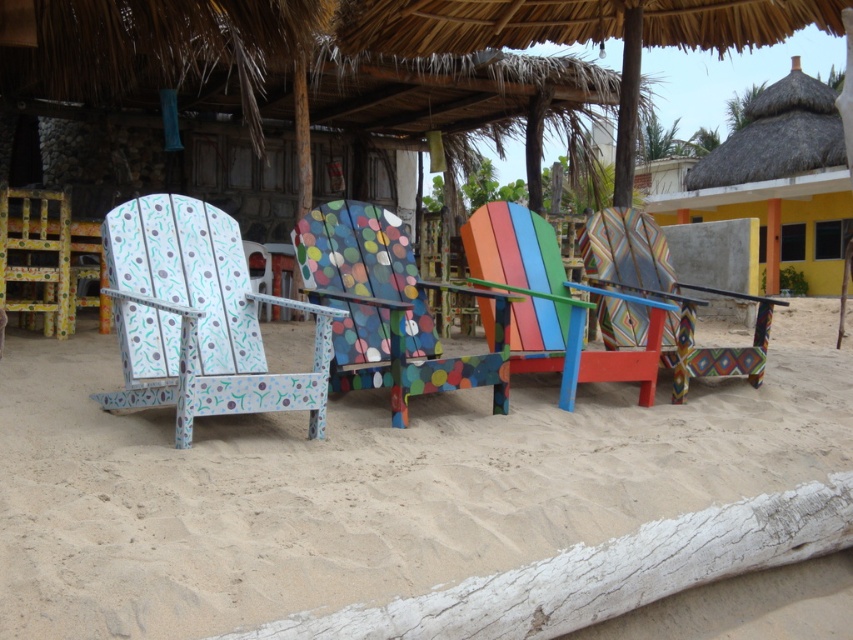
Question: Can you confirm if polka dot painted wood chair at center is smaller than multicolored painted chair at center?

Choices:
 (A) no
 (B) yes

Answer: (B)

Question: Which of these objects is positioned closest to the matte painted wood chair at left?

Choices:
 (A) textured multicolored chair at center
 (B) thatched roof hut at upper right
 (C) multicolored painted chair at center

Answer: (C)

Question: Among these objects, which one is farthest from the camera?

Choices:
 (A) matte painted wood chair at left
 (B) sandy beach at lower center
 (C) polka dot painted wood chair at center
 (D) textured multicolored chair at center

Answer: (D)

Question: Where is polka dot painted wood chair at center located in relation to thatched roof hut at upper right in the image?

Choices:
 (A) below
 (B) above

Answer: (A)

Question: Which point appears farthest from the camera in this image?

Choices:
 (A) (181, 289)
 (B) (759, 333)
 (C) (546, 243)
 (D) (280, 566)

Answer: (B)

Question: Can you confirm if matte painted wood chair at left is smaller than multicolored painted chair at center?

Choices:
 (A) no
 (B) yes

Answer: (B)